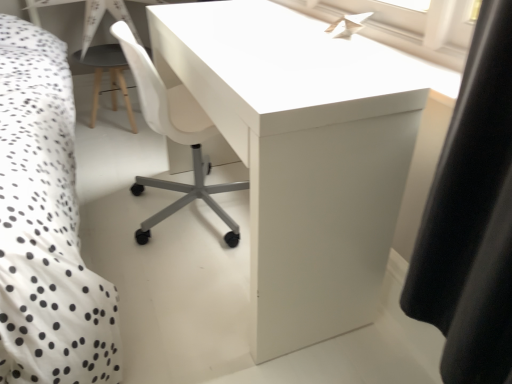
Question: From a real-world perspective, is white paper airplane at upper center located higher than matte gray stool at left?

Choices:
 (A) no
 (B) yes

Answer: (B)

Question: Is white paper airplane at upper center oriented towards matte gray stool at left?

Choices:
 (A) no
 (B) yes

Answer: (A)

Question: Does white paper airplane at upper center have a lesser width compared to matte gray stool at left?

Choices:
 (A) no
 (B) yes

Answer: (B)

Question: From a real-world perspective, is white paper airplane at upper center below matte gray stool at left?

Choices:
 (A) yes
 (B) no

Answer: (B)

Question: Would you say white paper airplane at upper center contains matte gray stool at left?

Choices:
 (A) yes
 (B) no

Answer: (B)

Question: Does white paper airplane at upper center appear on the left side of matte gray stool at left?

Choices:
 (A) yes
 (B) no

Answer: (B)

Question: Considering the relative sizes of white glossy desk at center and white paper airplane at upper center in the image provided, is white glossy desk at center thinner than white paper airplane at upper center?

Choices:
 (A) no
 (B) yes

Answer: (A)

Question: Considering the relative positions of white glossy desk at center and white paper airplane at upper center in the image provided, is white glossy desk at center to the right of white paper airplane at upper center from the viewer's perspective?

Choices:
 (A) yes
 (B) no

Answer: (B)

Question: Is white glossy desk at center further to camera compared to white paper airplane at upper center?

Choices:
 (A) yes
 (B) no

Answer: (B)

Question: Considering the relative sizes of white glossy desk at center and white paper airplane at upper center in the image provided, is white glossy desk at center wider than white paper airplane at upper center?

Choices:
 (A) yes
 (B) no

Answer: (A)

Question: Is white glossy desk at center in front of white paper airplane at upper center?

Choices:
 (A) yes
 (B) no

Answer: (A)

Question: Is white glossy desk at center facing away from white paper airplane at upper center?

Choices:
 (A) no
 (B) yes

Answer: (B)

Question: From the image's perspective, is white paper airplane at upper center located beneath white glossy desk at center?

Choices:
 (A) yes
 (B) no

Answer: (B)